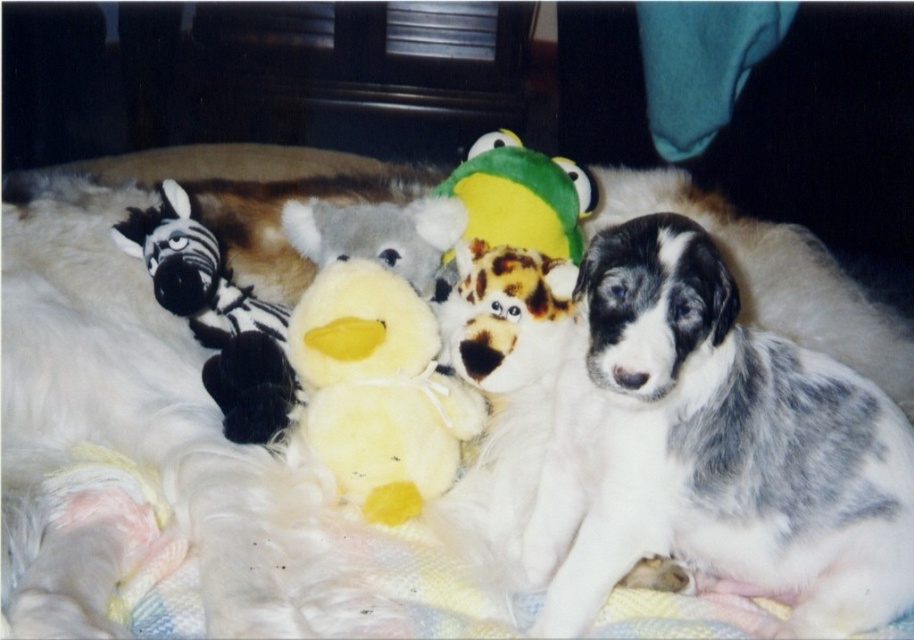
Does fluffy plush dog at center have a lesser width compared to green plush frog at center?

Yes, fluffy plush dog at center is thinner than green plush frog at center.

Is fluffy plush dog at center taller than green plush frog at center?

No, fluffy plush dog at center is not taller than green plush frog at center.

Between point (457, 312) and point (477, 157), which one is positioned behind?

Positioned behind is point (477, 157).

The width and height of the screenshot is (914, 640). I want to click on fluffy plush dog at center, so click(x=503, y=314).

I want to click on spotted fur puppy at center, so click(713, 449).

In the scene shown: Which is above, spotted fur puppy at center or fluffy yellow duck at center?

fluffy yellow duck at center is above.

Measure the distance between point [700,308] and camera.

Point [700,308] is 26.93 inches away from camera.

Identify the location of spotted fur puppy at center. The width and height of the screenshot is (914, 640). (713, 449).

Between point (328, 333) and point (474, 305), which one is positioned in front?

Point (328, 333) is more forward.

What do you see at coordinates (377, 392) in the screenshot?
I see `fluffy yellow duck at center` at bounding box center [377, 392].

Locate an element on the screen. This screenshot has height=640, width=914. fluffy yellow duck at center is located at coordinates (377, 392).

In order to click on fluffy yellow duck at center in this screenshot , I will do `click(377, 392)`.